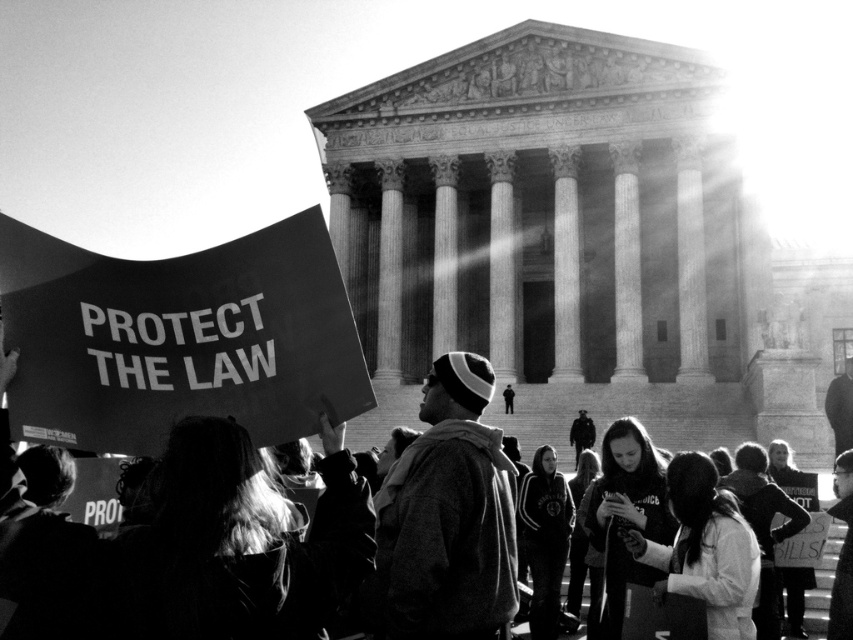
Is point (381, 540) positioned in front of point (614, 378)?

Yes, point (381, 540) is closer to viewer.

Measure the distance between point (467, 387) and camera.

A distance of 76.75 meters exists between point (467, 387) and camera.

Locate an element on the screen. knit cap at center is located at coordinates (447, 516).